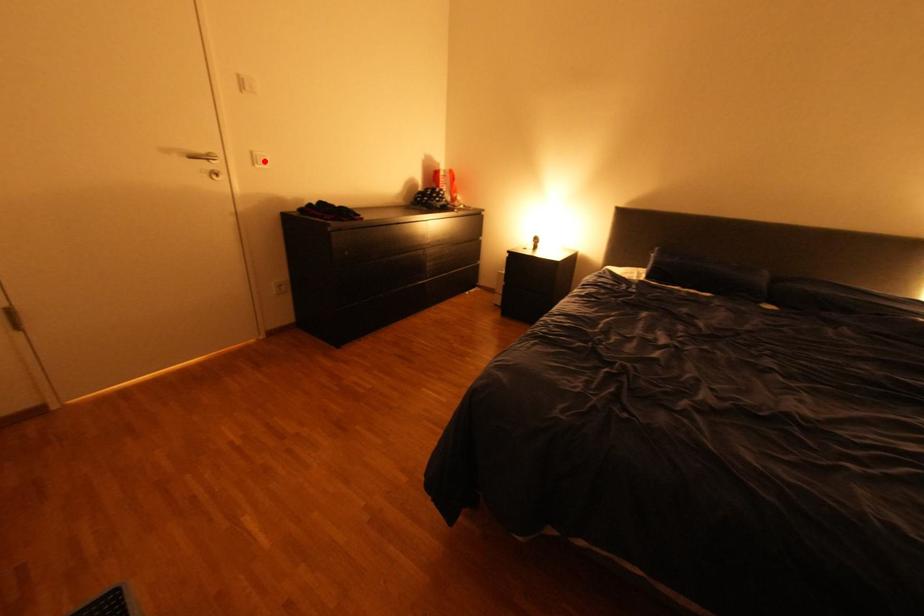
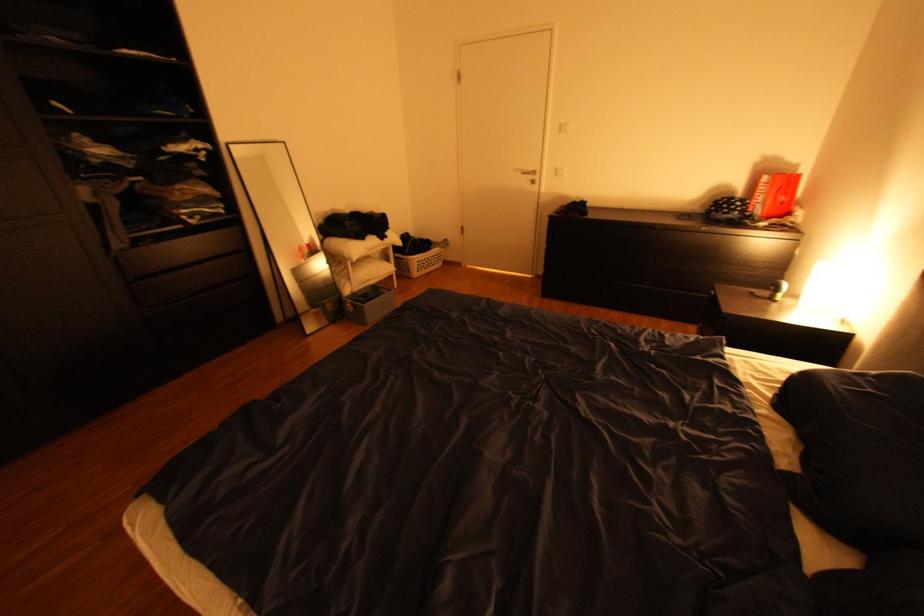
Question: A red point is marked in image1. In image2, is the corresponding 3D point closer to the camera or farther? Reply with the corresponding letter.

Choices:
 (A) The corresponding 3D point is closer.
 (B) The corresponding 3D point is farther.

Answer: (A)